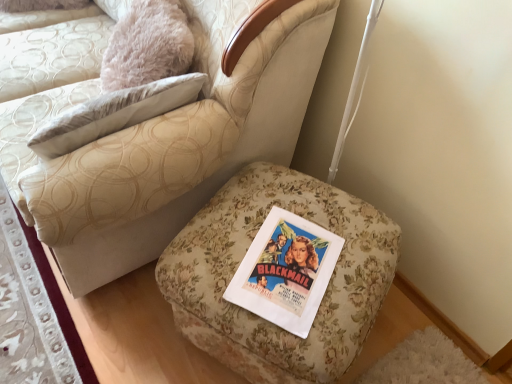
Question: Is floral fabric ottoman at center outside floral fabric ottoman at lower left?

Choices:
 (A) no
 (B) yes

Answer: (B)

Question: Is floral fabric ottoman at center shorter than floral fabric ottoman at lower left?

Choices:
 (A) no
 (B) yes

Answer: (A)

Question: Is the position of floral fabric ottoman at center more distant than that of floral fabric ottoman at lower left?

Choices:
 (A) no
 (B) yes

Answer: (A)

Question: Is floral fabric ottoman at center at the left side of floral fabric ottoman at lower left?

Choices:
 (A) no
 (B) yes

Answer: (A)

Question: Does floral fabric ottoman at center appear on the right side of floral fabric ottoman at lower left?

Choices:
 (A) yes
 (B) no

Answer: (A)

Question: From the image's perspective, is floral fabric ottoman at center on top of floral fabric ottoman at lower left?

Choices:
 (A) yes
 (B) no

Answer: (A)

Question: Is floral fabric ottoman at lower right far from floral fabric ottoman at lower left?

Choices:
 (A) yes
 (B) no

Answer: (B)

Question: Could you tell me if floral fabric ottoman at lower right is turned towards floral fabric ottoman at lower left?

Choices:
 (A) yes
 (B) no

Answer: (B)

Question: Is floral fabric ottoman at lower right completely or partially outside of floral fabric ottoman at lower left?

Choices:
 (A) yes
 (B) no

Answer: (A)

Question: Can you confirm if floral fabric ottoman at lower right is taller than floral fabric ottoman at lower left?

Choices:
 (A) no
 (B) yes

Answer: (B)

Question: From the image's perspective, is floral fabric ottoman at lower right under floral fabric ottoman at lower left?

Choices:
 (A) yes
 (B) no

Answer: (B)

Question: Considering the relative sizes of floral fabric ottoman at lower right and floral fabric ottoman at lower left in the image provided, is floral fabric ottoman at lower right thinner than floral fabric ottoman at lower left?

Choices:
 (A) yes
 (B) no

Answer: (B)

Question: Can you confirm if floral fabric ottoman at lower left is positioned to the left of floral fabric ottoman at lower right?

Choices:
 (A) yes
 (B) no

Answer: (A)